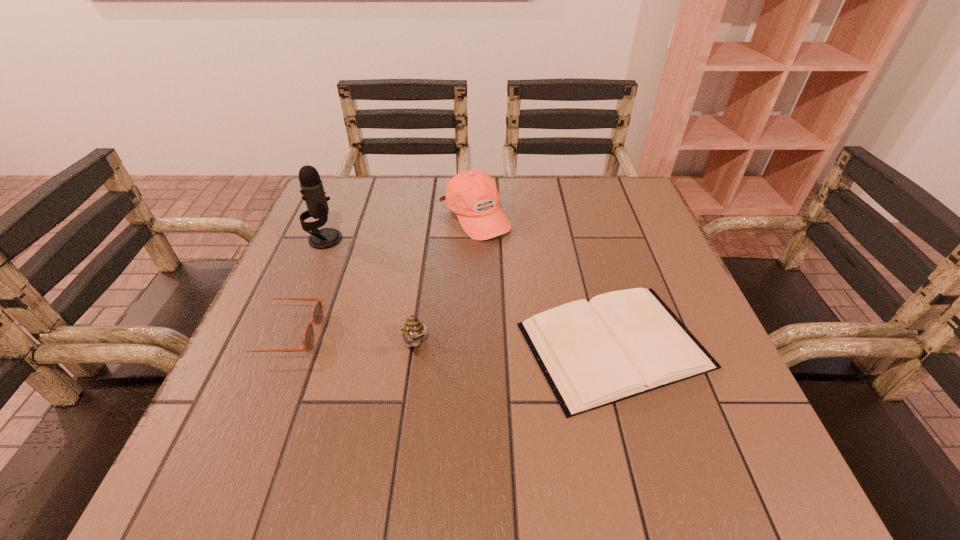
This screenshot has height=540, width=960. I want to click on microphone, so click(x=313, y=193).

Identify the location of the second tallest object. The image size is (960, 540). (472, 195).

The height and width of the screenshot is (540, 960). Find the location of `snail`. snail is located at coordinates (413, 330).

You are a GUI agent. You are given a task and a screenshot of the screen. Output one action in this format:
    pyautogui.click(x=<x>, y=<y>)
    Task: Click on the fourth tallest object
    
    Given the screenshot: What is the action you would take?
    pyautogui.click(x=308, y=337)

The height and width of the screenshot is (540, 960). In order to click on hardback book in this screenshot , I will do `click(620, 344)`.

Where is `vacant space positioned on the right of the microphone`? vacant space positioned on the right of the microphone is located at coordinates [x=498, y=239].

Identify the location of vacant space located on the left of the baseball cap. (359, 217).

The image size is (960, 540). I want to click on blank space located 0.190m on the face of the snail, so click(396, 472).

Identify the location of vacant space positioned 0.190m on the front-facing side of the second shortest object. The image size is (960, 540). (419, 334).

Locate an element on the screen. This screenshot has height=540, width=960. free point located 0.110m on the front of the shortest object is located at coordinates (655, 490).